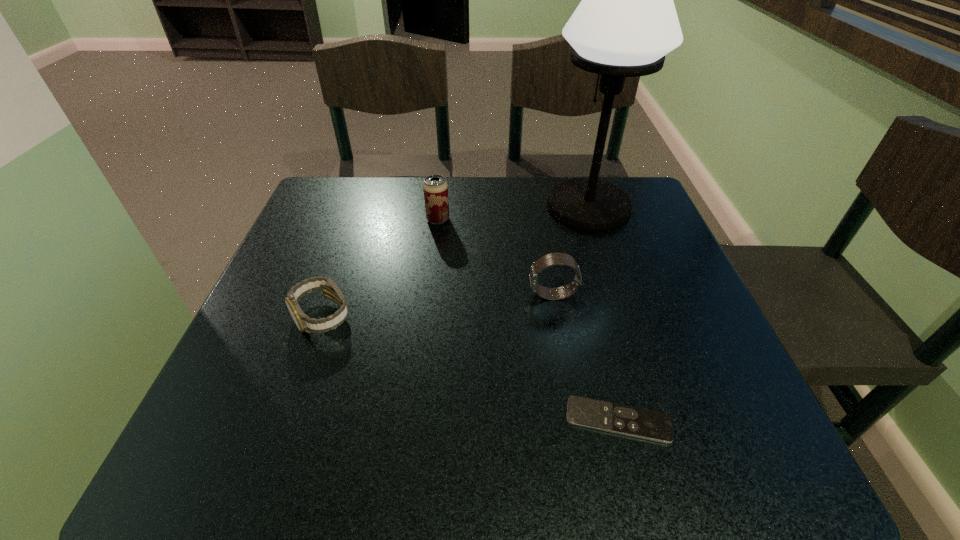
What are the coordinates of `object that is positioned at the far right corner` in the screenshot? It's located at (626, 23).

The height and width of the screenshot is (540, 960). What are the coordinates of `object present at the near right corner` in the screenshot? It's located at (642, 423).

The height and width of the screenshot is (540, 960). In the image, there is a desktop. In order to click on vacant area at the far edge in this screenshot , I will do `click(535, 214)`.

This screenshot has height=540, width=960. What are the coordinates of `free spot at the near edge of the desktop` in the screenshot? It's located at (666, 471).

Where is `free spot at the left edge of the desktop`? Image resolution: width=960 pixels, height=540 pixels. free spot at the left edge of the desktop is located at coordinates (261, 404).

This screenshot has height=540, width=960. Identify the location of vacant space at the right edge of the desktop. (656, 350).

Locate an element on the screen. This screenshot has width=960, height=540. free space at the far left corner of the desktop is located at coordinates (348, 212).

This screenshot has height=540, width=960. I want to click on vacant area at the near left corner, so click(x=219, y=456).

This screenshot has width=960, height=540. In order to click on vacant region between the taller watch and the nearest object in this screenshot , I will do `click(586, 357)`.

This screenshot has width=960, height=540. I want to click on empty space between the tallest object and the shorter watch, so click(x=455, y=261).